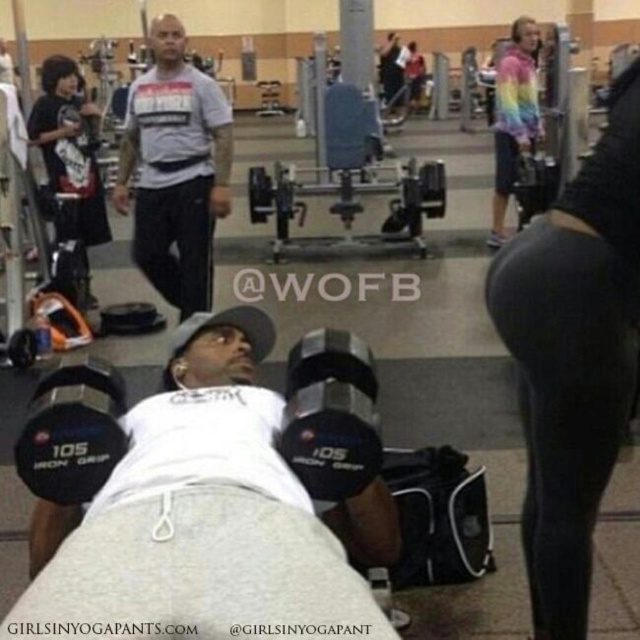
Is point (208, 211) positioned behind point (323, 412)?

Yes, point (208, 211) is behind point (323, 412).

Between point (216, 124) and point (310, 428), which one is positioned behind?

The point (216, 124) is more distant.

Which is behind, point (156, 273) or point (324, 442)?

Positioned behind is point (156, 273).

The height and width of the screenshot is (640, 640). What are the coordinates of `white t-shirt at center` in the screenshot? It's located at (176, 170).

Is point (360, 381) positioned in front of point (497, 184)?

Yes, it is in front of point (497, 184).

Where is `black iron grip dumbbells at center`? The image size is (640, 640). black iron grip dumbbells at center is located at coordinates (72, 436).

Can you confirm if white t-shirt at center is smaller than rainbow tie-dye hoodie at upper right?

Yes.

Between point (144, 256) and point (536, 113), which one is positioned behind?

The point (536, 113) is behind.

Locate an element on the screen. The image size is (640, 640). white t-shirt at center is located at coordinates (176, 170).